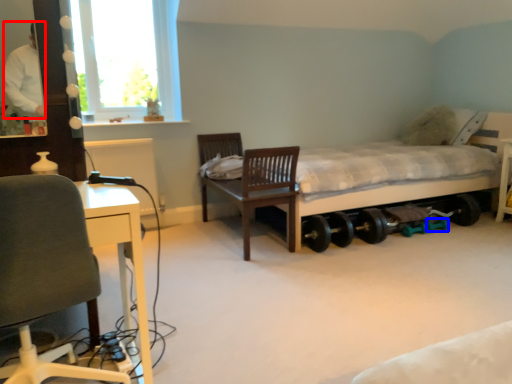
Question: Which object appears closest to the camera in this image, person (highlighted by a red box) or wheel (highlighted by a blue box)?

Choices:
 (A) person
 (B) wheel

Answer: (A)